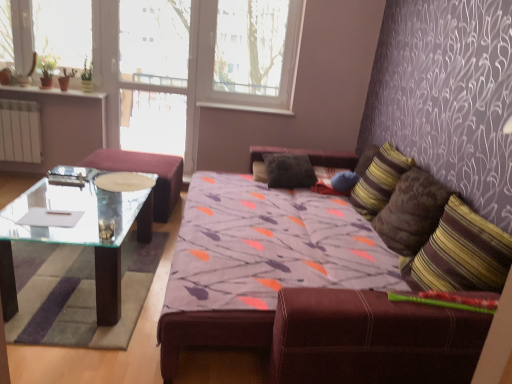
Question: From a real-world perspective, is striped fabric pillow at right, marked as the second pillow in a left-to-right arrangement, above or below transparent glass coffee table at left?

Choices:
 (A) below
 (B) above

Answer: (B)

Question: Does point click(x=375, y=178) appear closer or farther from the camera than point click(x=74, y=241)?

Choices:
 (A) closer
 (B) farther

Answer: (A)

Question: Based on their relative distances, which object is nearer to the white plastic window frame at upper center?

Choices:
 (A) green glass window screen at upper left
 (B) striped fabric pillow at right
 (C) transparent glass door at upper center
 (D) transparent glass coffee table at left
 (E) black fabric pillow at center, which is counted as the 3th pillow, starting from the front

Answer: (C)

Question: Based on their relative distances, which object is nearer to the white paper at left?

Choices:
 (A) white plastic window frame at upper center
 (B) striped fabric pillow at right
 (C) green glass window screen at upper left
 (D) white plastic window sill at upper center
 (E) black fabric pillow at center, the 1th pillow in the left-to-right sequence

Answer: (E)